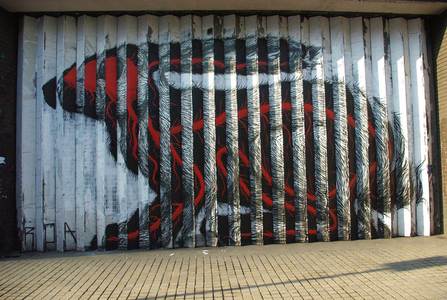
You are a GUI agent. You are given a task and a screenshot of the screen. Output one action in this format:
    pyautogui.click(x=<x>, y=<y>)
    Task: Click on the wedges (in wall)
    This screenshot has height=300, width=447.
    Given the screenshot: What is the action you would take?
    pyautogui.click(x=66, y=184)